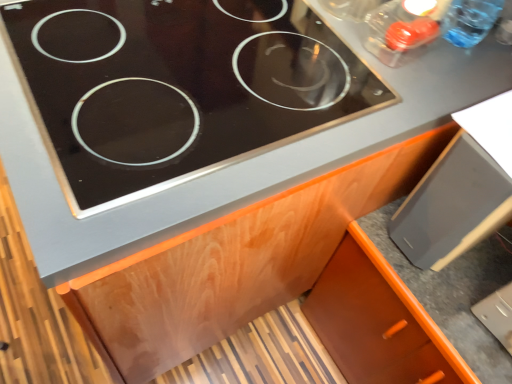
Question: Is matte black drawer at lower right positioned with its back to black glass cooktop at upper center?

Choices:
 (A) no
 (B) yes

Answer: (A)

Question: Can you confirm if matte black drawer at lower right is smaller than black glass cooktop at upper center?

Choices:
 (A) yes
 (B) no

Answer: (A)

Question: Does matte black drawer at lower right have a greater height compared to black glass cooktop at upper center?

Choices:
 (A) no
 (B) yes

Answer: (B)

Question: Are matte black drawer at lower right and black glass cooktop at upper center making contact?

Choices:
 (A) yes
 (B) no

Answer: (B)

Question: Can we say matte black drawer at lower right lies outside black glass cooktop at upper center?

Choices:
 (A) no
 (B) yes

Answer: (B)

Question: Can you confirm if matte black drawer at lower right is thinner than black glass cooktop at upper center?

Choices:
 (A) yes
 (B) no

Answer: (A)

Question: Does black glass cooktop at upper center touch transparent plastic bottle at upper right?

Choices:
 (A) no
 (B) yes

Answer: (A)

Question: Can you confirm if black glass cooktop at upper center is taller than transparent plastic bottle at upper right?

Choices:
 (A) no
 (B) yes

Answer: (A)

Question: Is black glass cooktop at upper center far away from transparent plastic bottle at upper right?

Choices:
 (A) no
 (B) yes

Answer: (A)

Question: Can you confirm if black glass cooktop at upper center is wider than transparent plastic bottle at upper right?

Choices:
 (A) no
 (B) yes

Answer: (B)

Question: From a real-world perspective, is black glass cooktop at upper center over transparent plastic bottle at upper right?

Choices:
 (A) yes
 (B) no

Answer: (B)

Question: Does black glass cooktop at upper center have a larger size compared to transparent plastic bottle at upper right?

Choices:
 (A) yes
 (B) no

Answer: (A)

Question: Is orange wood cabinet at lower right located within black glass cooktop at upper center?

Choices:
 (A) yes
 (B) no

Answer: (B)